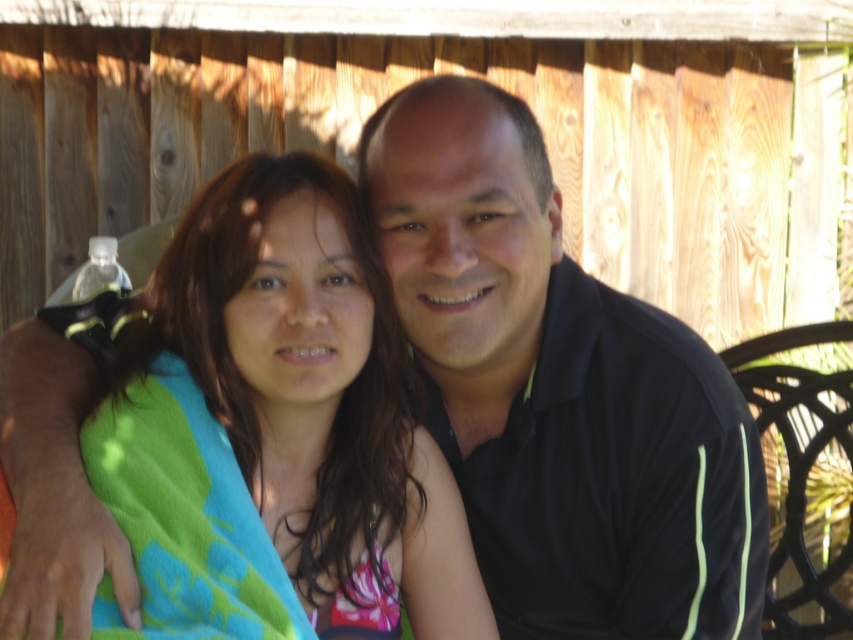
Question: Is the position of black smooth shirt at center more distant than that of green towel at center?

Choices:
 (A) yes
 (B) no

Answer: (A)

Question: Which of the following is the farthest from the observer?

Choices:
 (A) green towel at center
 (B) black smooth shirt at center

Answer: (B)

Question: Which object appears farthest from the camera in this image?

Choices:
 (A) black smooth shirt at center
 (B) green towel at center

Answer: (A)

Question: Is black smooth shirt at center further to camera compared to green towel at center?

Choices:
 (A) yes
 (B) no

Answer: (A)

Question: Which point appears closest to the camera in this image?

Choices:
 (A) (469, 360)
 (B) (395, 477)

Answer: (B)

Question: Where is black smooth shirt at center located in relation to green towel at center in the image?

Choices:
 (A) above
 (B) below

Answer: (A)